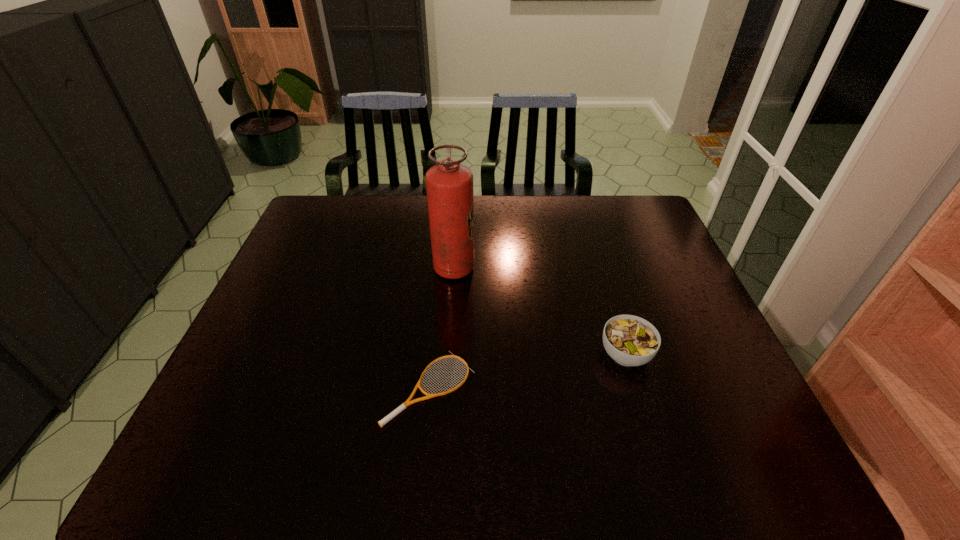
Identify the location of fire extinguisher. The image size is (960, 540). (449, 185).

Locate an element on the screen. the tallest object is located at coordinates (449, 185).

Where is `soup bowl`? soup bowl is located at coordinates (629, 340).

This screenshot has height=540, width=960. In order to click on the rightmost object in this screenshot , I will do `click(629, 340)`.

Where is `the shortest object`? The image size is (960, 540). the shortest object is located at coordinates pos(408,402).

The image size is (960, 540). I want to click on vacant space located on the label side of the farthest object, so click(x=534, y=268).

Where is `free space located 0.070m on the front of the rightmost object`? The image size is (960, 540). free space located 0.070m on the front of the rightmost object is located at coordinates (640, 403).

At what (x,y) coordinates should I click in order to perform the action: click on vacant space located 0.290m on the right of the shortest object. Please return your answer as a coordinate pair (x, y). Looking at the image, I should click on (601, 388).

The width and height of the screenshot is (960, 540). In the image, there is a desktop. Find the location of `vacant space at the far edge`. vacant space at the far edge is located at coordinates (425, 197).

Locate an element on the screen. free space at the near edge of the desktop is located at coordinates (540, 442).